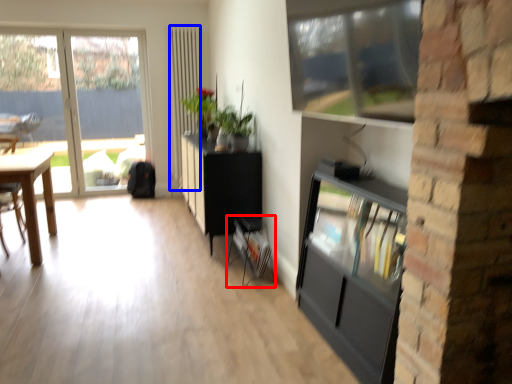
Question: Which object is closer to the camera taking this photo, shelf (highlighted by a red box) or screen door (highlighted by a blue box)?

Choices:
 (A) shelf
 (B) screen door

Answer: (A)